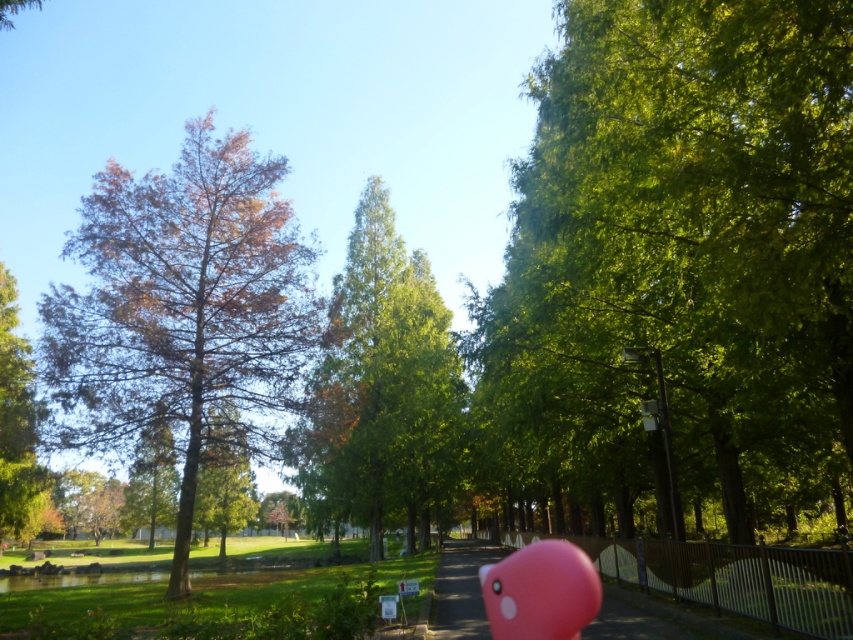
Question: Among these points, which one is nearest to the camera?

Choices:
 (A) (846, 236)
 (B) (494, 608)
 (C) (612, 595)

Answer: (A)

Question: Which is nearer to the green glossy tree at center?

Choices:
 (A) green matte tree at center
 (B) pink rubber balloon at lower right

Answer: (B)

Question: Among these points, which one is nearest to the camera?

Choices:
 (A) (552, 557)
 (B) (659, 637)

Answer: (B)

Question: Is pink rubber duck at center positioned behind pink rubber balloon at lower right?

Choices:
 (A) yes
 (B) no

Answer: (B)

Question: In this image, where is pink rubber duck at center located relative to green glossy tree at left?

Choices:
 (A) above
 (B) below

Answer: (B)

Question: Is green leafy tree at right bigger than pink rubber balloon at lower right?

Choices:
 (A) no
 (B) yes

Answer: (B)